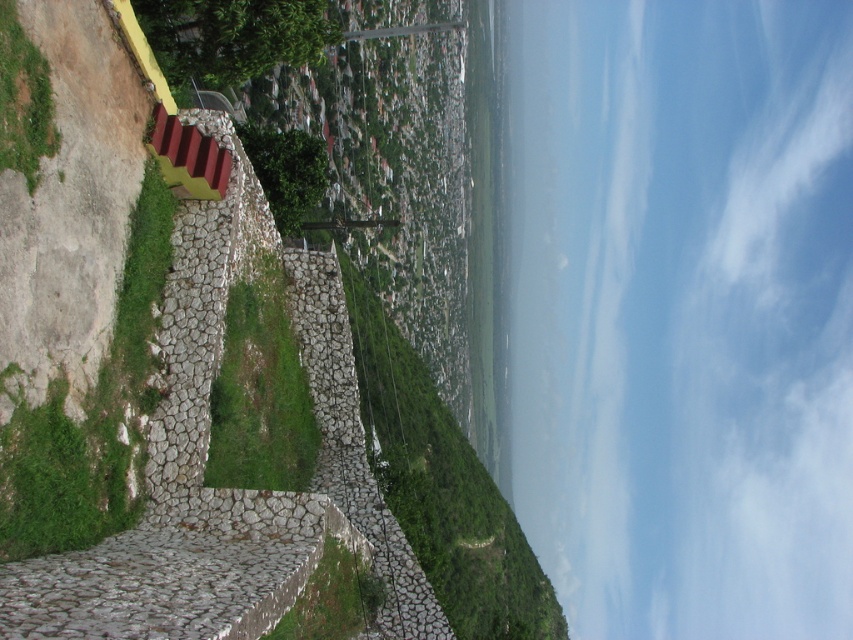
The image size is (853, 640). What do you see at coordinates (260, 392) in the screenshot?
I see `green grass at center` at bounding box center [260, 392].

Does green grass at center appear on the right side of green leafy grass at lower left?

Indeed, green grass at center is positioned on the right side of green leafy grass at lower left.

This screenshot has height=640, width=853. What do you see at coordinates (260, 392) in the screenshot? I see `green grass at center` at bounding box center [260, 392].

At what (x,y) coordinates should I click in order to perform the action: click on green grass at center. Please return your answer as a coordinate pair (x, y). Looking at the image, I should click on (260, 392).

How distant is green leafy grass at center from green mossy stone at lower left?

A distance of 48.53 meters exists between green leafy grass at center and green mossy stone at lower left.

Does point (465, 609) come behind point (21, 413)?

Yes.

The height and width of the screenshot is (640, 853). Find the location of `green leafy grass at center`. green leafy grass at center is located at coordinates (442, 486).

Which is above, green leafy grass at center or green leafy grass at lower left?

green leafy grass at lower left is higher up.

Which of these two, green leafy grass at center or green leafy grass at lower left, stands taller?

green leafy grass at center is taller.

This screenshot has height=640, width=853. Find the location of `green leafy grass at center`. green leafy grass at center is located at coordinates (442, 486).